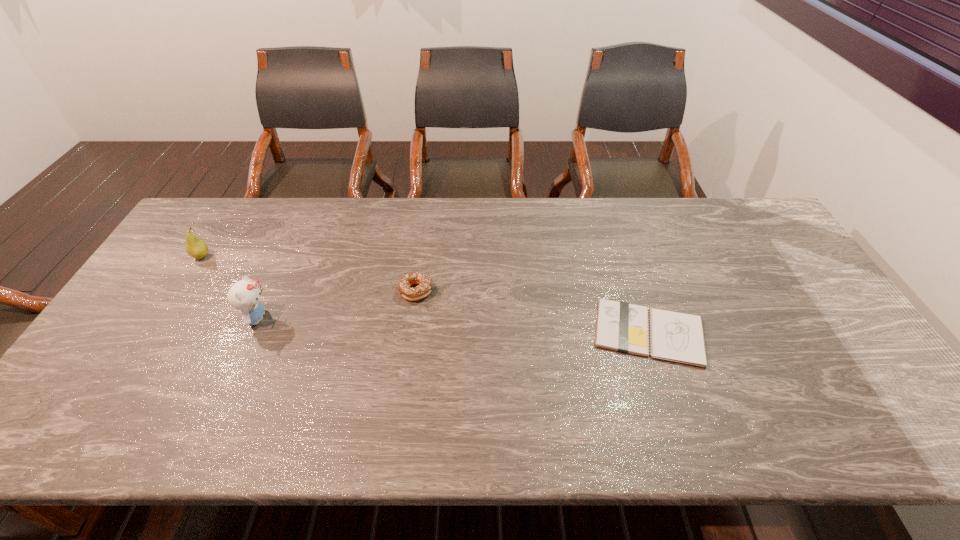
Find the location of a particular element. Image resolution: width=960 pixels, height=540 pixels. free location located 0.330m on the right of the shortest object is located at coordinates (829, 333).

This screenshot has height=540, width=960. Find the location of `object present at the left edge`. object present at the left edge is located at coordinates click(x=196, y=248).

This screenshot has width=960, height=540. Identify the location of vacant area at the far edge of the desktop. (333, 234).

Image resolution: width=960 pixels, height=540 pixels. I want to click on vacant area at the near edge, so click(552, 420).

Locate an element on the screen. The image size is (960, 540). free location at the right edge of the desktop is located at coordinates (809, 302).

In the image, there is a desktop. Identify the location of vacant space at the far left corner. (211, 238).

At what (x,y) coordinates should I click in order to perform the action: click on vacant space at the near left corner of the desktop. Please return your answer as a coordinate pair (x, y). This screenshot has height=540, width=960. Looking at the image, I should click on (85, 424).

Where is `vacant space at the far right corner of the desktop`? The image size is (960, 540). vacant space at the far right corner of the desktop is located at coordinates [x=770, y=230].

This screenshot has height=540, width=960. I want to click on vacant area that lies between the rightmost object and the doughnut, so click(533, 312).

You are a GUI agent. You are given a task and a screenshot of the screen. Output one action in this format:
    pyautogui.click(x=<x>, y=<y>)
    Task: Click on the vacant area between the kitten and the third tallest object
    This screenshot has width=960, height=540.
    Given the screenshot: What is the action you would take?
    pyautogui.click(x=337, y=305)